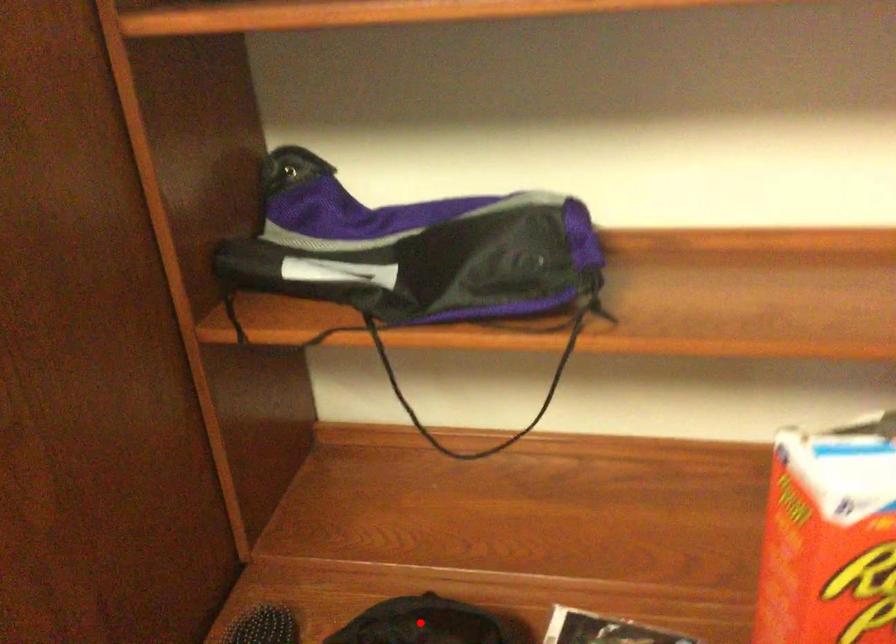
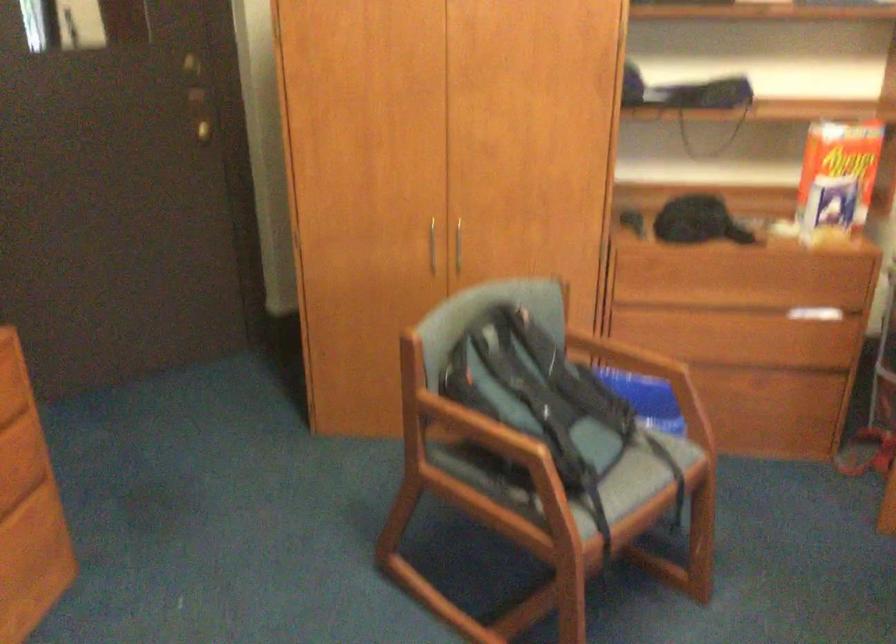
Question: I am providing you with two images of the same scene from different viewpoints. A red point is marked on the first image. Is the red point's position out of view in image 2?

Choices:
 (A) Yes
 (B) No

Answer: (A)